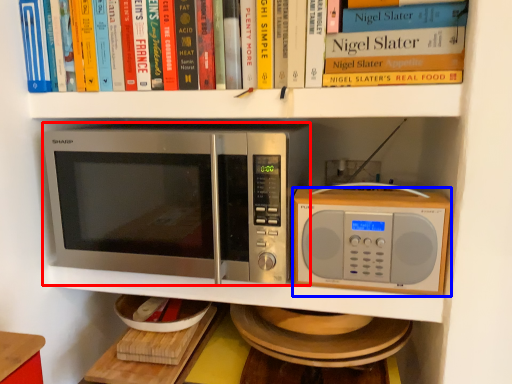
Question: Which of the following is the farthest to the observer, microwave oven (highlighted by a red box) or microwave oven (highlighted by a blue box)?

Choices:
 (A) microwave oven
 (B) microwave oven

Answer: (B)